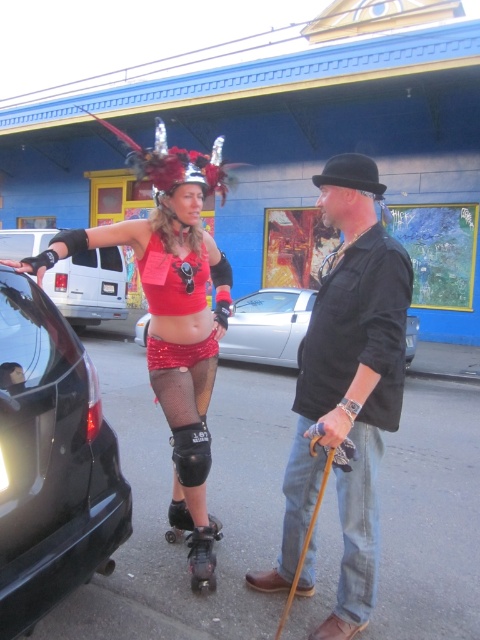
Is black glossy car at left to the right of shiny red skirt at center from the viewer's perspective?

No, black glossy car at left is not to the right of shiny red skirt at center.

This screenshot has width=480, height=640. Describe the element at coordinates (50, 460) in the screenshot. I see `black glossy car at left` at that location.

Where is `black glossy car at left`? The image size is (480, 640). black glossy car at left is located at coordinates (50, 460).

Is shiny red skirt at center smaller than black matte car at left?

Correct, shiny red skirt at center occupies less space than black matte car at left.

Is shiny red skirt at center further to camera compared to black matte car at left?

No.

Describe the element at coordinates (164, 241) in the screenshot. I see `shiny red skirt at center` at that location.

Find the location of `shiny red skirt at center`. shiny red skirt at center is located at coordinates [x=164, y=241].

Is the position of black matte bowler hat at center less distant than that of black matte knee pad at center?

Yes, it is in front of black matte knee pad at center.

Does black matte bowler hat at center have a smaller size compared to black matte knee pad at center?

Incorrect, black matte bowler hat at center is not smaller in size than black matte knee pad at center.

Does point (277, 586) lie in front of point (191, 486)?

Yes, point (277, 586) is closer to viewer.

Locate an element on the screen. black matte bowler hat at center is located at coordinates (347, 387).